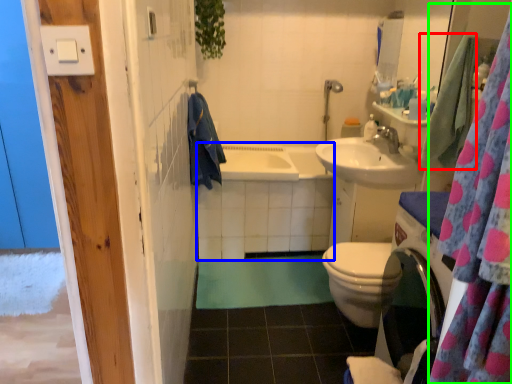
Question: Which is nearer to the bath towel (highlighted by a red box)? bath (highlighted by a blue box) or shower curtain (highlighted by a green box).

Choices:
 (A) bath
 (B) shower curtain

Answer: (A)